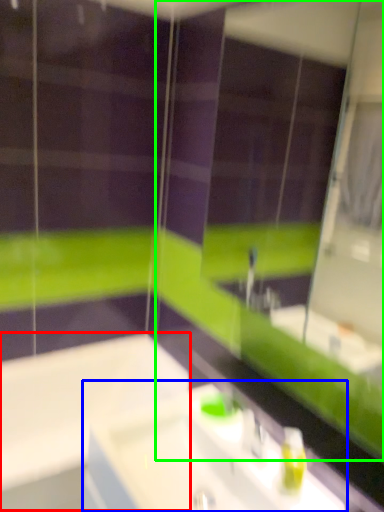
Question: Which is farther away from bath (highlighted by a red box)? sink (highlighted by a blue box) or mirror (highlighted by a green box)?

Choices:
 (A) sink
 (B) mirror

Answer: (B)